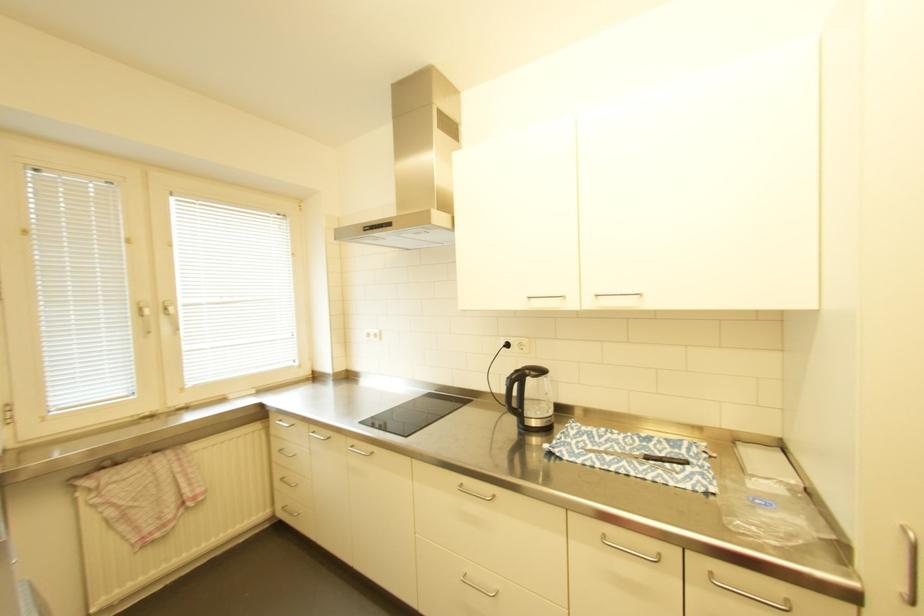
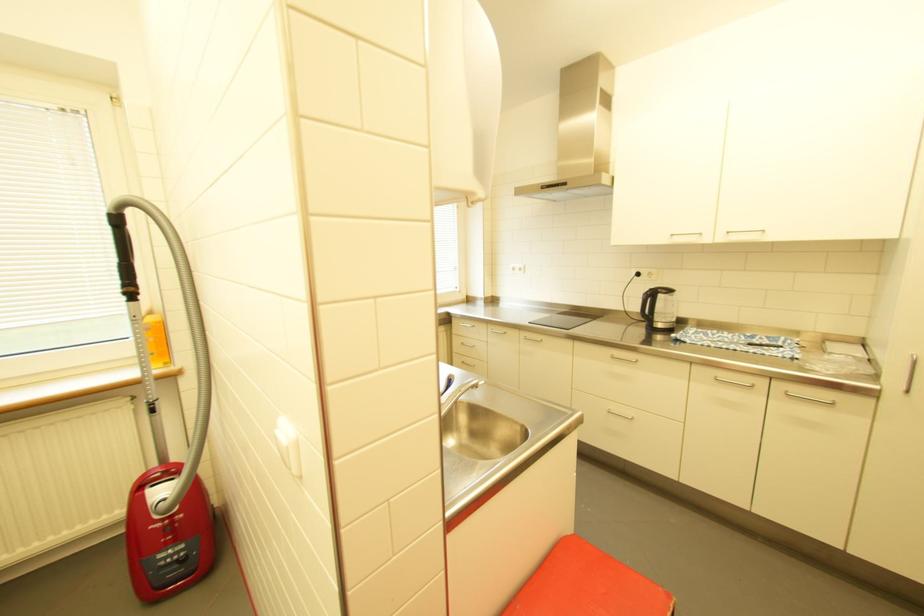
Find the pixel in the second image that matches pixel 516 379 in the first image.

(651, 294)